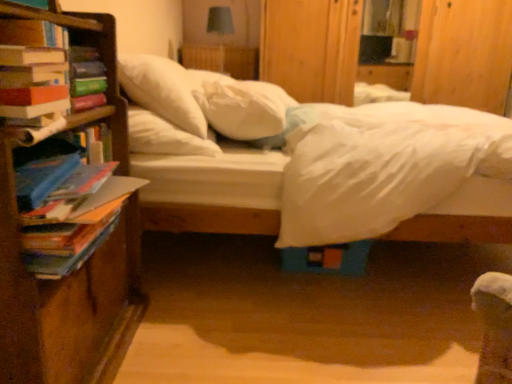
Question: Can you confirm if white soft bed at center is thinner than white soft pillow at center, arranged as the 1th pillow when viewed from the left?

Choices:
 (A) yes
 (B) no

Answer: (B)

Question: Does white soft bed at center turn towards white soft pillow at center, the 2th pillow when ordered from right to left?

Choices:
 (A) yes
 (B) no

Answer: (B)

Question: Is white soft bed at center behind white soft pillow at center, the 2th pillow when ordered from right to left?

Choices:
 (A) yes
 (B) no

Answer: (B)

Question: Is white soft bed at center positioned in front of white soft pillow at center, arranged as the 1th pillow when viewed from the left?

Choices:
 (A) no
 (B) yes

Answer: (B)

Question: Does white soft bed at center have a greater width compared to white soft pillow at center, arranged as the 1th pillow when viewed from the left?

Choices:
 (A) no
 (B) yes

Answer: (B)

Question: Does white soft bed at center touch white soft pillow at center, the 2th pillow when ordered from right to left?

Choices:
 (A) no
 (B) yes

Answer: (B)

Question: Is hardcover book at left, positioned as the second book in bottom-to-top order, positioned with its back to white soft bed at center?

Choices:
 (A) yes
 (B) no

Answer: (B)

Question: Considering the relative sizes of hardcover book at left, which is the first book from top to bottom, and white soft bed at center in the image provided, is hardcover book at left, which is the first book from top to bottom, bigger than white soft bed at center?

Choices:
 (A) yes
 (B) no

Answer: (B)

Question: Considering the relative sizes of hardcover book at left, which is the first book from top to bottom, and white soft bed at center in the image provided, is hardcover book at left, which is the first book from top to bottom, shorter than white soft bed at center?

Choices:
 (A) no
 (B) yes

Answer: (B)

Question: From the image's perspective, is hardcover book at left, positioned as the second book in bottom-to-top order, on white soft bed at center?

Choices:
 (A) yes
 (B) no

Answer: (A)

Question: Would you consider hardcover book at left, positioned as the second book in bottom-to-top order, to be distant from white soft bed at center?

Choices:
 (A) no
 (B) yes

Answer: (A)

Question: From a real-world perspective, is hardcover book at left, positioned as the second book in bottom-to-top order, over white soft bed at center?

Choices:
 (A) no
 (B) yes

Answer: (B)

Question: Is multicolored paper book at left, the second book viewed from the top, located within white soft bed at center?

Choices:
 (A) yes
 (B) no

Answer: (B)